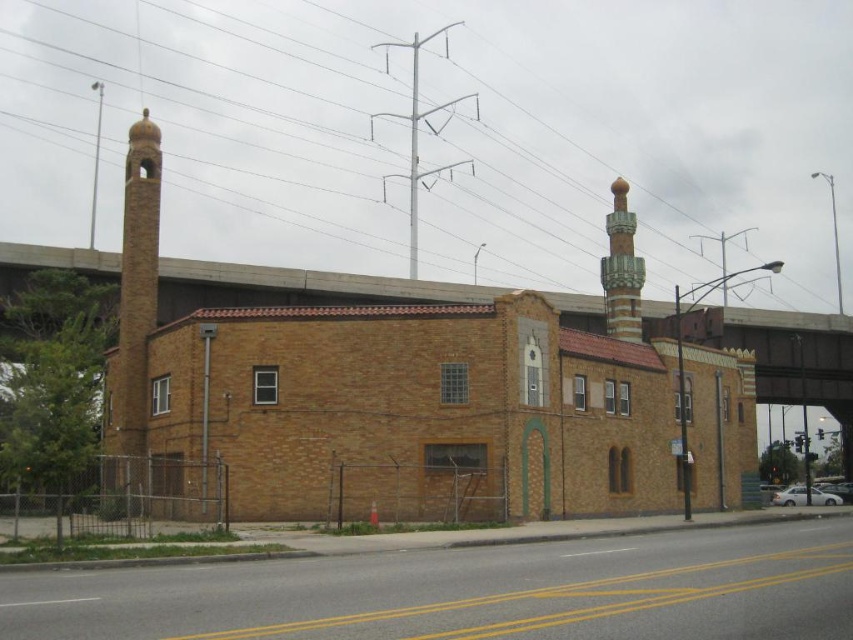
Question: In this image, where is metallic gray power line at upper center located relative to green glazed tile minaret at upper right?

Choices:
 (A) above
 (B) below

Answer: (A)

Question: Based on their relative distances, which object is nearer to the green glazed tile minaret at upper right?

Choices:
 (A) metallic gray power line at upper center
 (B) brown brick overpass at upper center

Answer: (B)

Question: Which point appears farthest from the camera in this image?

Choices:
 (A) (78, 115)
 (B) (614, 241)

Answer: (A)

Question: Observing the image, what is the correct spatial positioning of brown brick overpass at upper center in reference to green glazed tile minaret at upper right?

Choices:
 (A) right
 (B) left

Answer: (A)

Question: Which point is closer to the camera?

Choices:
 (A) brown brick overpass at upper center
 (B) green glazed tile minaret at upper right

Answer: (A)

Question: Is metallic gray power line at upper center above green glazed tile minaret at upper right?

Choices:
 (A) yes
 (B) no

Answer: (A)